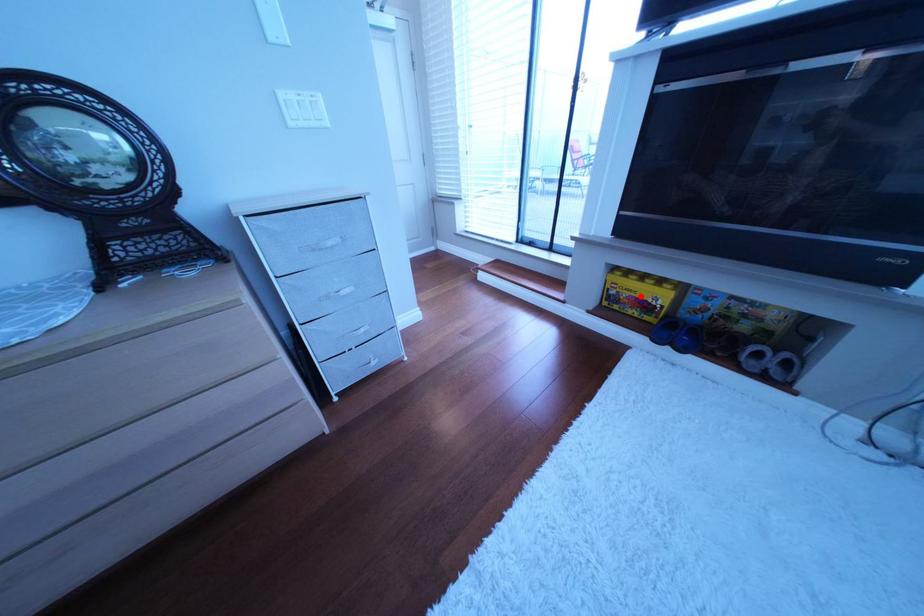
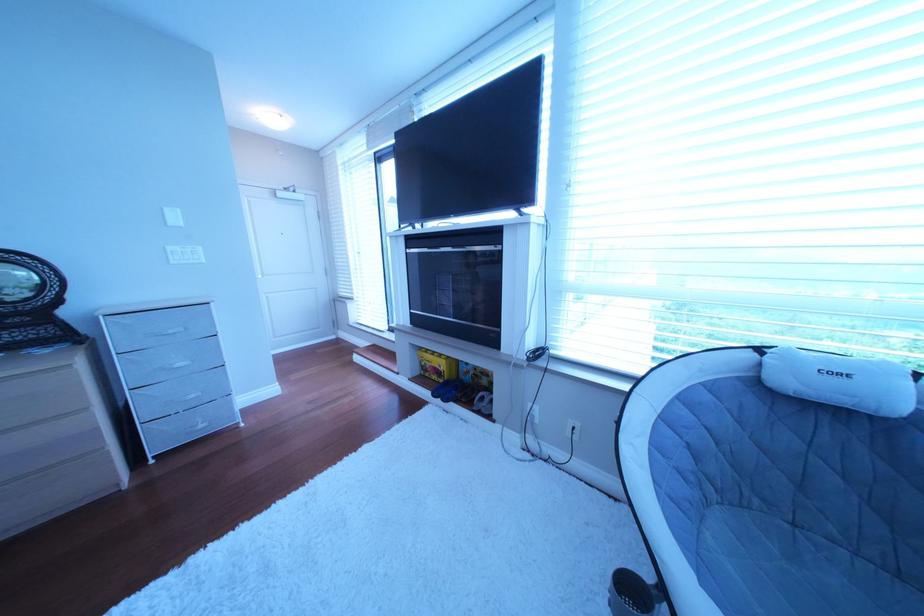
Question: I am providing you with two images of the same scene from different viewpoints. A red point is marked on the first image. At the location where the point appears in image 1, is it still visible in image 2?

Choices:
 (A) Yes
 (B) No

Answer: (A)